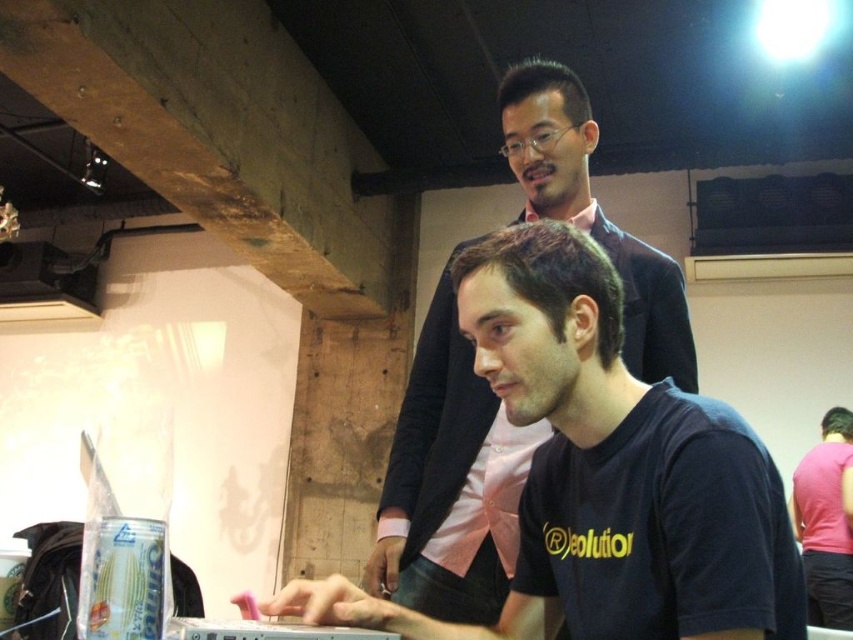
You are organizing a charity clothing drive and need to sort shirts by size. You have a black matte shirt at center and a pink satin shirt at upper center. Which shirt should you place in the small size bin?

The black matte shirt at center should be placed in the small size bin because it has a smaller size compared to the pink satin shirt at upper center.

You are a security camera in the room. You need to determine the location of the pink satin shirt at upper center. What are its coordinates?

The coordinates of the pink satin shirt at upper center are at point [450,481].